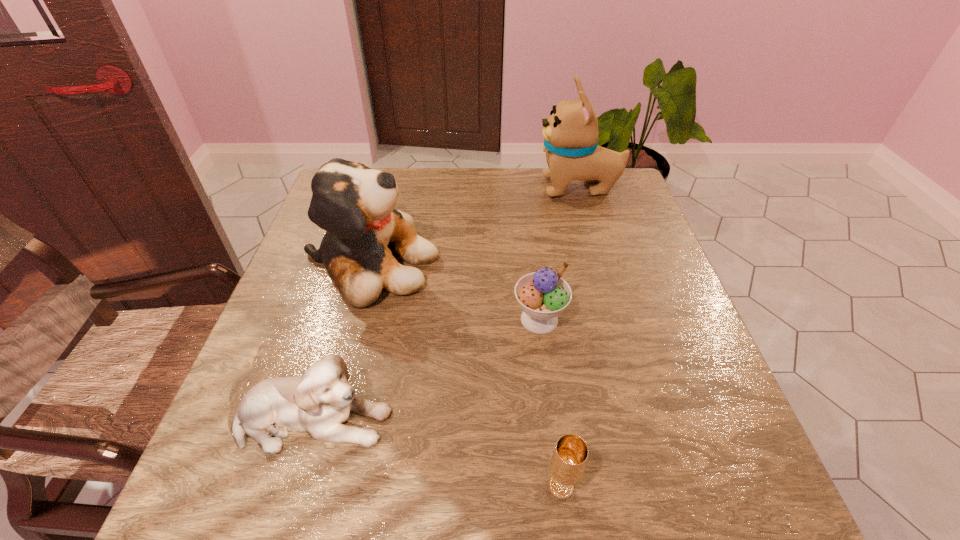
You are a GUI agent. You are given a task and a screenshot of the screen. Output one action in this format:
    pyautogui.click(x=<x>, y=<y>)
    Task: Click on the free location that satisfies the following two spatial constraints: 1. at the face of the second farthest puppy; 2. on the back side of the nearest object
    The height and width of the screenshot is (540, 960).
    Given the screenshot: What is the action you would take?
    pyautogui.click(x=310, y=487)

Where is `vacant region that satisfies the following two spatial constraints: 1. on the back side of the nearest object; 2. on the front-facing side of the shortest puppy`? This screenshot has width=960, height=540. vacant region that satisfies the following two spatial constraints: 1. on the back side of the nearest object; 2. on the front-facing side of the shortest puppy is located at coordinates (552, 420).

I want to click on free location that satisfies the following two spatial constraints: 1. on the front-facing side of the chalice; 2. on the right side of the second nearest object, so click(x=295, y=487).

This screenshot has height=540, width=960. What are the coordinates of `blank area in the image that satisfies the following two spatial constraints: 1. at the face of the second nearest puppy; 2. on the right side of the chalice` in the screenshot? It's located at (310, 487).